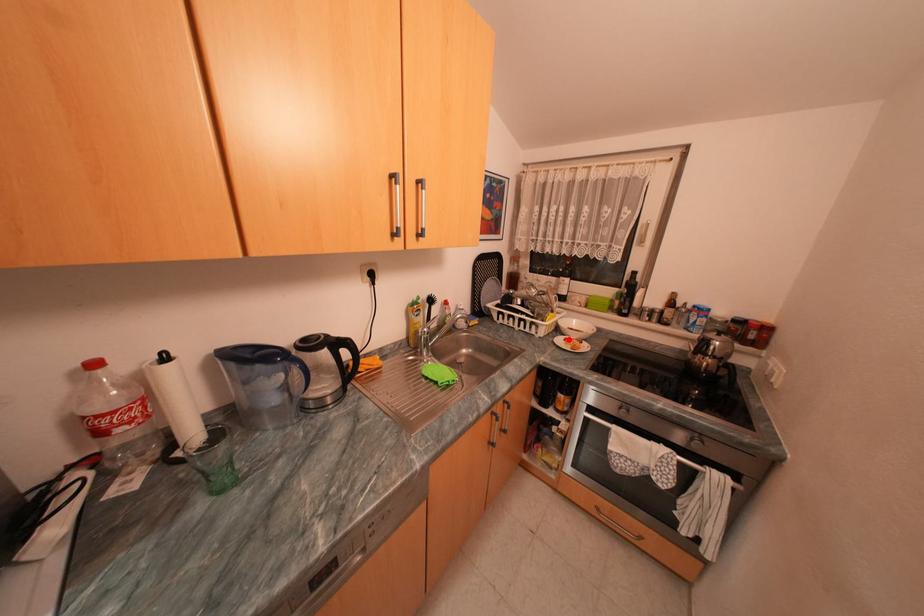
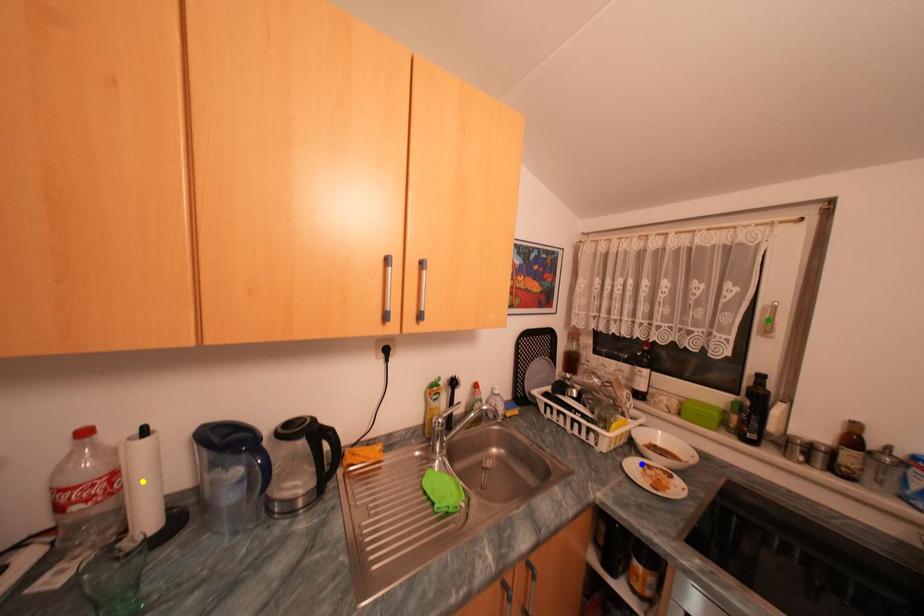
Question: I am providing you with two images of the same scene from different viewpoints. A red point is marked on the first image. You are given multiple points on the second image. In image 2, which mark is for the same physical point as the one in image 1?

Choices:
 (A) green point
 (B) yellow point
 (C) blue point

Answer: (C)